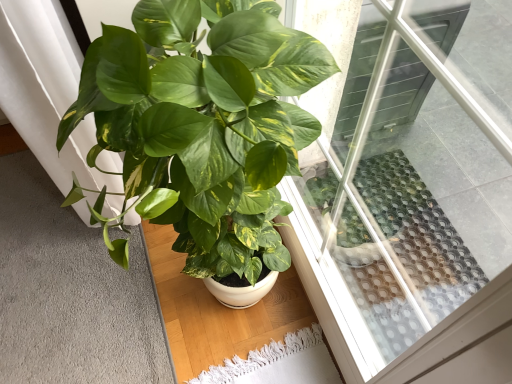
Question: In the image, is green glossy leafy plant at center positioned in front of or behind transparent glass window at upper center?

Choices:
 (A) front
 (B) behind

Answer: (B)

Question: Is point (140, 43) positioned closer to the camera than point (351, 344)?

Choices:
 (A) closer
 (B) farther

Answer: (A)

Question: Which object is the closest to the transparent glass window at upper center?

Choices:
 (A) green glossy leafy plant at center
 (B) soft gray carpet at lower left

Answer: (A)

Question: Estimate the real-world distances between objects in this image. Which object is closer to the green glossy leafy plant at center?

Choices:
 (A) soft gray carpet at lower left
 (B) transparent glass window at upper center

Answer: (B)